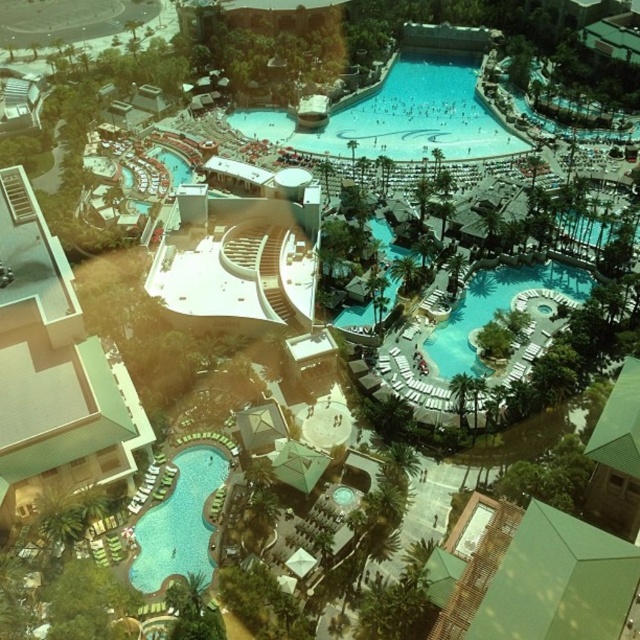
Question: Which object is the closest to the clear blue water at center?

Choices:
 (A) blue glossy pool at lower left
 (B) white concrete building at lower left

Answer: (B)

Question: Is blue glossy pool at lower left above shiny blue pool at center right?

Choices:
 (A) yes
 (B) no

Answer: (B)

Question: Which point is closer to the camera?

Choices:
 (A) blue glossy pool at lower left
 (B) clear blue water at center
 (C) shiny blue pool at center right
 (D) white concrete building at lower left

Answer: (D)

Question: Does white concrete building at lower left appear on the left side of blue glossy pool at lower left?

Choices:
 (A) yes
 (B) no

Answer: (A)

Question: Which point is farther from the camera taking this photo?

Choices:
 (A) (486, 289)
 (B) (212, 456)
 (C) (38, 392)
 (D) (508, 134)

Answer: (D)

Question: Is white concrete building at lower left to the left of clear blue water at center from the viewer's perspective?

Choices:
 (A) yes
 (B) no

Answer: (A)